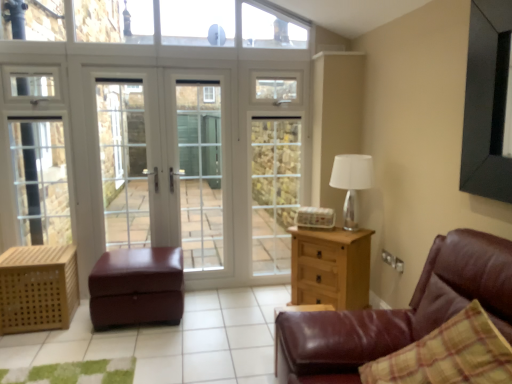
Question: Choose the correct answer: Is clear glass window at upper center inside silver metallic table lamp at upper right or outside it?

Choices:
 (A) outside
 (B) inside

Answer: (A)

Question: Is point (254, 44) positioned closer to the camera than point (355, 188)?

Choices:
 (A) closer
 (B) farther

Answer: (B)

Question: Estimate the real-world distances between objects in this image. Which object is closer to the wooden crate at lower left?

Choices:
 (A) white glass screen door at center, which ranks as the first screen door in right-to-left order
 (B) leather ottoman at center
 (C) light wood/texture chest of drawers at right
 (D) white glass screen door at left, which ranks as the 1th screen door in left-to-right order
 (E) silver metallic table lamp at upper right

Answer: (B)

Question: Estimate the real-world distances between objects in this image. Which object is closer to the clear glass window at upper center?

Choices:
 (A) white glass door at center
 (B) silver metallic table lamp at upper right
 (C) leather ottoman at center
 (D) light wood/texture chest of drawers at right
 (E) brown leather couch at right

Answer: (A)